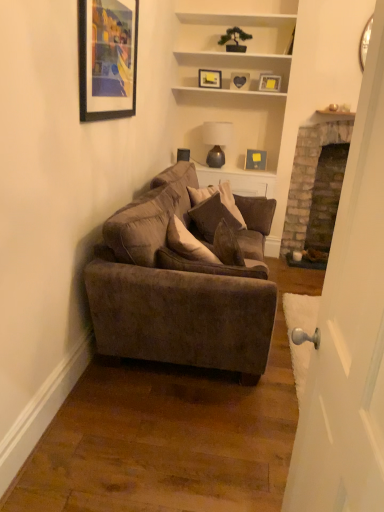
Where is `vacant space situated above white wood shelves at upper center (from a real-world perspective)`? vacant space situated above white wood shelves at upper center (from a real-world perspective) is located at coordinates (243, 17).